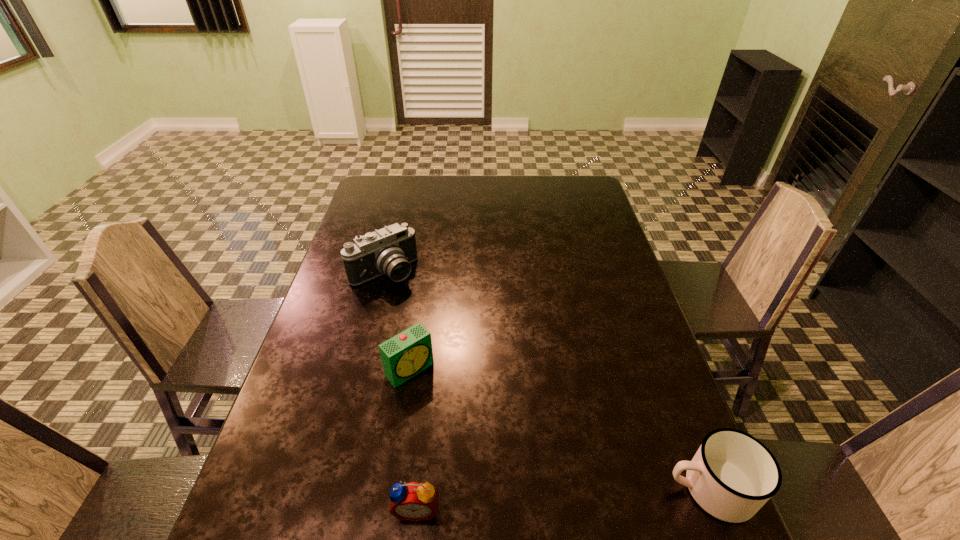
What are the coordinates of `free space between the nearer alarm clock and the tallest object` in the screenshot? It's located at (400, 390).

The image size is (960, 540). Find the location of `empty space between the farther alarm clock and the farthest object`. empty space between the farther alarm clock and the farthest object is located at coordinates (396, 321).

Image resolution: width=960 pixels, height=540 pixels. Identify the location of vacant area between the tallest object and the nearer alarm clock. (400, 390).

Find the location of a particular element. The width and height of the screenshot is (960, 540). free space between the tallest object and the second farthest object is located at coordinates (396, 321).

Image resolution: width=960 pixels, height=540 pixels. Identify the location of free space between the farthest object and the farther alarm clock. (396, 321).

You are a GUI agent. You are given a task and a screenshot of the screen. Output one action in this format:
    pyautogui.click(x=<x>, y=<y>)
    Task: Click on the closest object to the mug
    Image resolution: width=960 pixels, height=540 pixels.
    Given the screenshot: What is the action you would take?
    pyautogui.click(x=413, y=501)

Find the location of a particular element. object that stands as the third closest to the nearer alarm clock is located at coordinates (390, 250).

Identify the location of free space that satisfies the following two spatial constraints: 1. on the front side of the farthest object; 2. on the side of the mug with the handle. (328, 489).

Image resolution: width=960 pixels, height=540 pixels. Find the location of `vacant point that satisfies the following two spatial constraints: 1. on the front side of the tallest object; 2. on the left side of the third nearest object`. vacant point that satisfies the following two spatial constraints: 1. on the front side of the tallest object; 2. on the left side of the third nearest object is located at coordinates (359, 370).